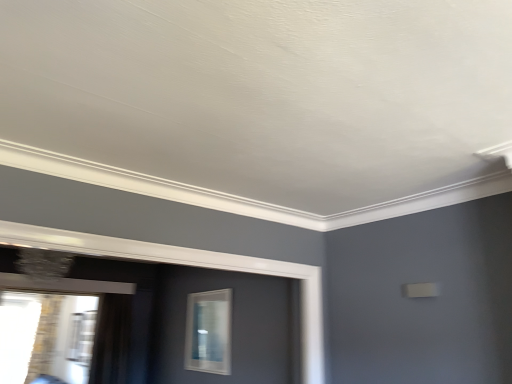
Question: Is point (195, 311) positioned closer to the camera than point (37, 322)?

Choices:
 (A) farther
 (B) closer

Answer: (B)

Question: In the image, is clear glass window at center, which appears as the 1th window when viewed from the right, positioned in front of or behind transparent glass window at lower left, which appears as the 2th window when viewed from the right?

Choices:
 (A) front
 (B) behind

Answer: (A)

Question: Which object is the farthest from the clear glass window at center, which appears as the 1th window when viewed from the right?

Choices:
 (A) transparent glass window at lower left, which is the first window in left-to-right order
 (B) black sheer curtain at left

Answer: (A)

Question: Which object is positioned farthest from the clear glass window at center, which appears as the 1th window when viewed from the right?

Choices:
 (A) black sheer curtain at left
 (B) transparent glass window at lower left, which appears as the 2th window when viewed from the right

Answer: (B)